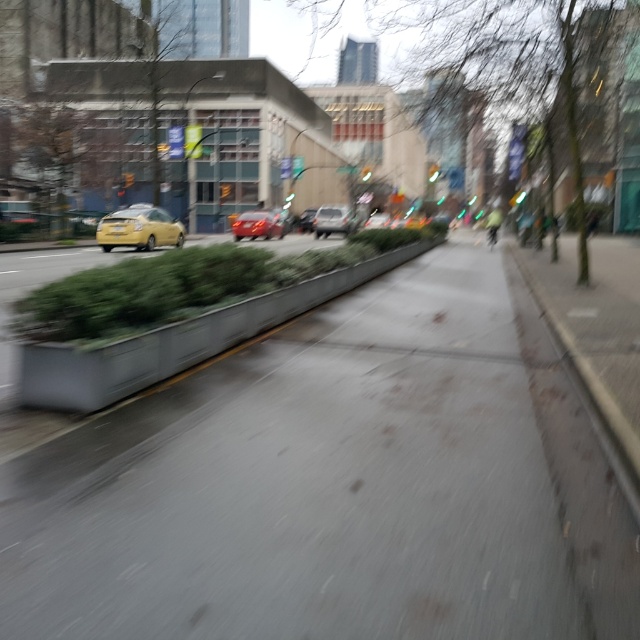
Question: Which object is positioned closest to the shiny red car at center?

Choices:
 (A) brown leafless tree at left
 (B) gray asphalt sidewalk at center
 (C) metallic silver sedan at center

Answer: (C)

Question: Which object is closer to the camera taking this photo?

Choices:
 (A) brown leafless tree at left
 (B) green leafy tree at center

Answer: (B)

Question: Does green leafy tree at center have a greater width compared to brown leafless tree at left?

Choices:
 (A) yes
 (B) no

Answer: (A)

Question: Which object appears closest to the camera in this image?

Choices:
 (A) concrete at center
 (B) brown leafless tree at left

Answer: (A)

Question: Is gray asphalt sidewalk at center below metallic silver sedan at center?

Choices:
 (A) yes
 (B) no

Answer: (A)

Question: Where is brown leafless tree at left located in relation to shiny red car at center in the image?

Choices:
 (A) below
 (B) above

Answer: (B)